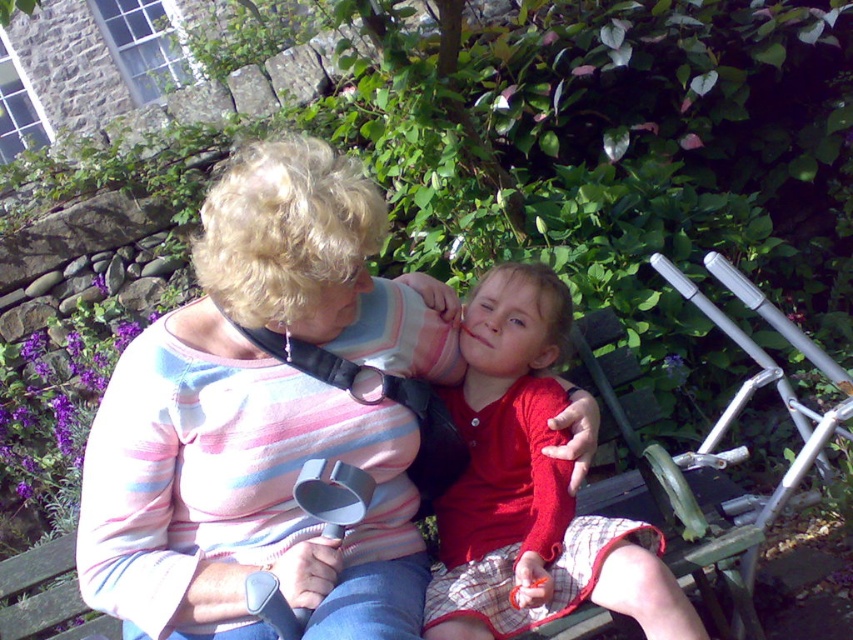
Question: Which is farther from the striped cotton sweater at center?

Choices:
 (A) silver metallic baby carriage at right
 (B) matte plastic bottle at center
 (C) matte red sweater at center

Answer: (A)

Question: Which object is the closest to the striped cotton sweater at center?

Choices:
 (A) matte red sweater at center
 (B) smooth red shirt at center
 (C) matte plastic bottle at center

Answer: (C)

Question: Does matte red sweater at center have a lesser width compared to silver metallic baby carriage at right?

Choices:
 (A) no
 (B) yes

Answer: (B)

Question: Is matte red sweater at center wider than silver metallic baby carriage at right?

Choices:
 (A) no
 (B) yes

Answer: (A)

Question: Can you confirm if striped cotton sweater at center is positioned above silver metallic baby carriage at right?

Choices:
 (A) no
 (B) yes

Answer: (A)

Question: Which point appears farthest from the camera in this image?

Choices:
 (A) pyautogui.click(x=549, y=307)
 (B) pyautogui.click(x=326, y=326)
 (C) pyautogui.click(x=766, y=376)

Answer: (C)